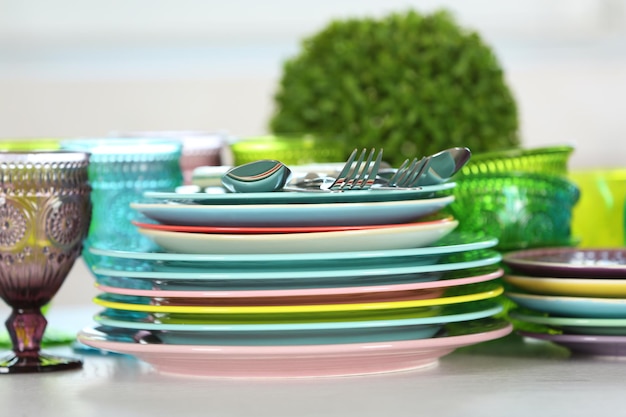
Image resolution: width=626 pixels, height=417 pixels. Find the location of `glass`. glass is located at coordinates (27, 208), (18, 143), (138, 175), (207, 148), (300, 148), (548, 158), (533, 208), (596, 196).